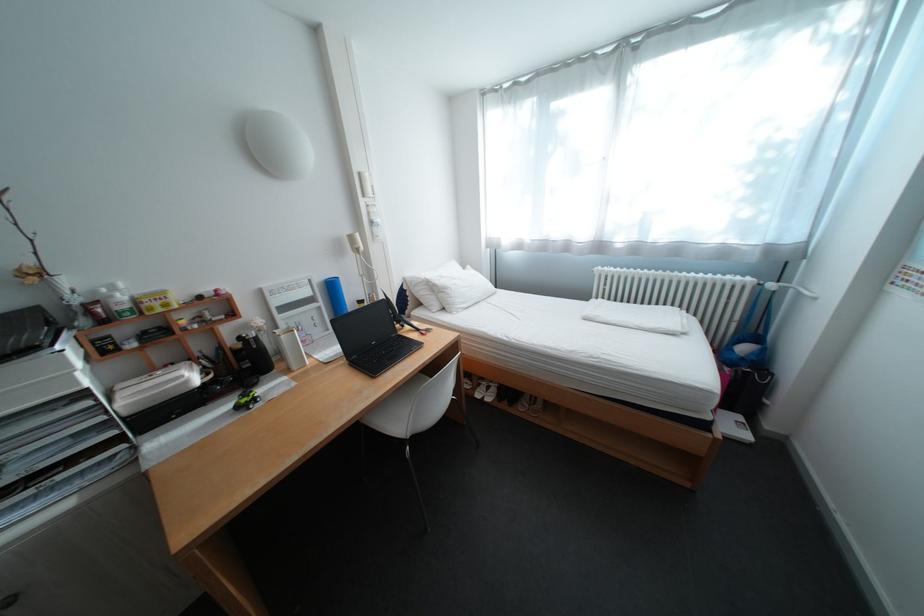
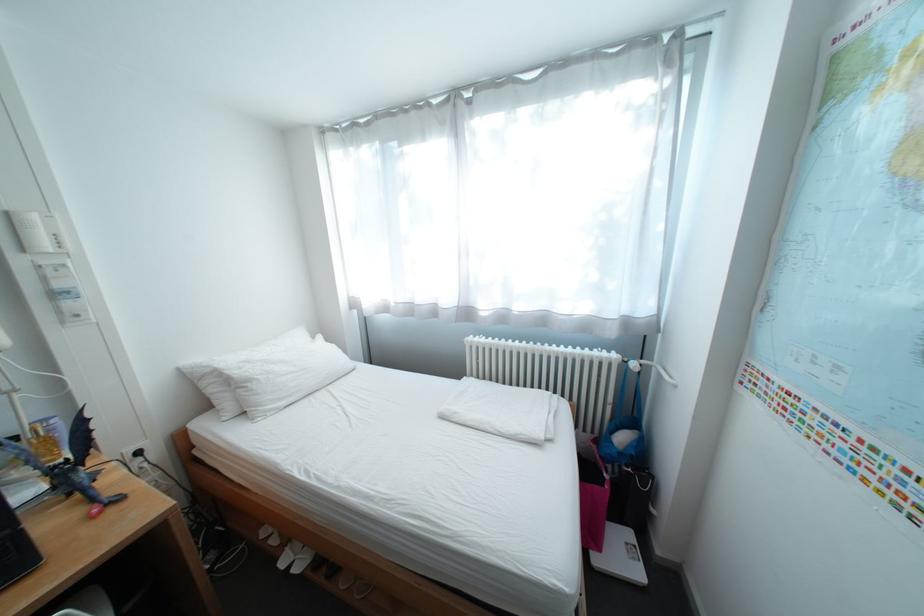
In the second image, find the point that corresponds to the point at 377,304 in the first image.

(31, 440)